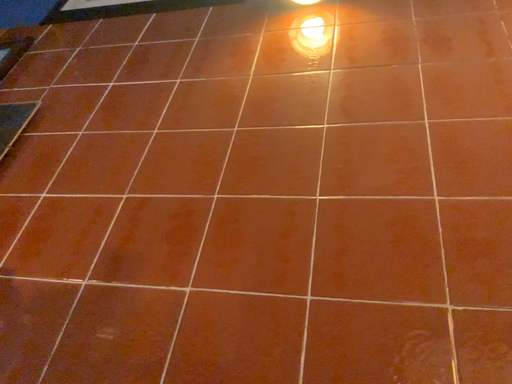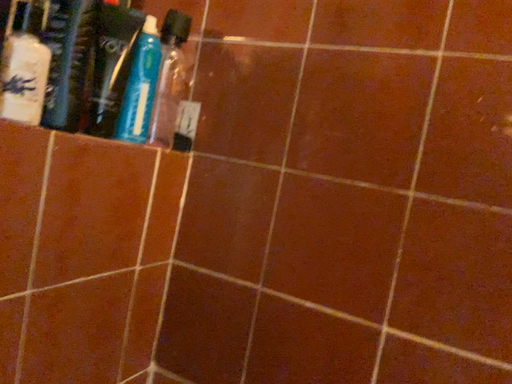
Question: Which way did the camera rotate in the video?

Choices:
 (A) rotated downward
 (B) rotated upward

Answer: (A)